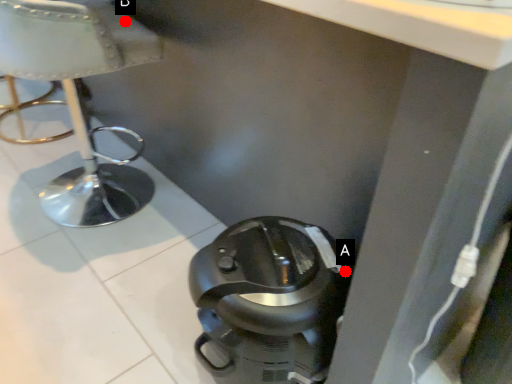
Question: Two points are circled on the image, labeled by A and B beside each circle. Which of the following is the closest to the observer?

Choices:
 (A) A is closer
 (B) B is closer

Answer: (A)